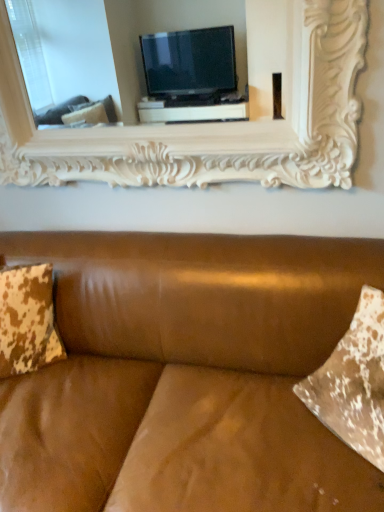
Question: Is white carved wood picture frame at upper center aimed at brown leather couch at center?

Choices:
 (A) yes
 (B) no

Answer: (B)

Question: Is white carved wood picture frame at upper center located outside brown leather couch at center?

Choices:
 (A) no
 (B) yes

Answer: (B)

Question: From a real-world perspective, is white carved wood picture frame at upper center on top of brown leather couch at center?

Choices:
 (A) no
 (B) yes

Answer: (B)

Question: Is white carved wood picture frame at upper center to the left of brown leather couch at center from the viewer's perspective?

Choices:
 (A) no
 (B) yes

Answer: (A)

Question: Is the position of white carved wood picture frame at upper center less distant than that of brown leather couch at center?

Choices:
 (A) yes
 (B) no

Answer: (B)

Question: From a real-world perspective, is white carved wood picture frame at upper center physically located above or below brown leather couch at center?

Choices:
 (A) below
 (B) above

Answer: (B)

Question: Choose the correct answer: Is white carved wood picture frame at upper center inside brown leather couch at center or outside it?

Choices:
 (A) inside
 (B) outside

Answer: (B)

Question: Is point (266, 34) positioned closer to the camera than point (236, 489)?

Choices:
 (A) farther
 (B) closer

Answer: (A)

Question: From the image's perspective, relative to brown leather couch at center, is white carved wood picture frame at upper center above or below?

Choices:
 (A) above
 (B) below

Answer: (A)

Question: In terms of width, does brown leather couch at center look wider or thinner when compared to brown distressed fabric pillow at left?

Choices:
 (A) thin
 (B) wide

Answer: (B)

Question: From the image's perspective, is brown leather couch at center located above or below brown distressed fabric pillow at left?

Choices:
 (A) above
 (B) below

Answer: (B)

Question: From a real-world perspective, relative to brown distressed fabric pillow at left, is brown leather couch at center vertically above or below?

Choices:
 (A) below
 (B) above

Answer: (A)

Question: Does point (309, 238) appear closer or farther from the camera than point (41, 334)?

Choices:
 (A) closer
 (B) farther

Answer: (A)

Question: Is point (145, 389) positioned closer to the camera than point (314, 156)?

Choices:
 (A) farther
 (B) closer

Answer: (B)

Question: From a real-world perspective, relative to white carved wood picture frame at upper center, is brown leather couch at center vertically above or below?

Choices:
 (A) below
 (B) above

Answer: (A)